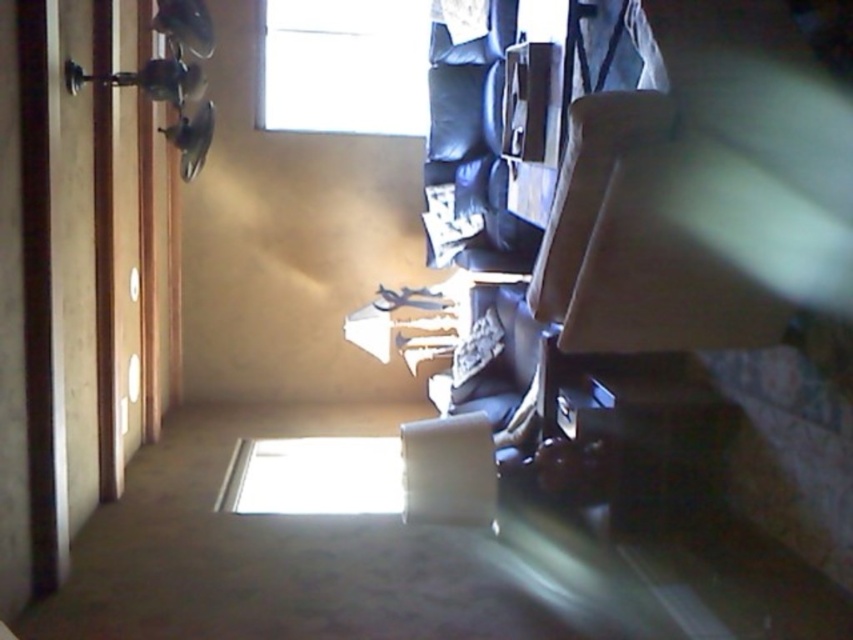
You are trying to determine which object is taller between the beige fabric armchair at center and the transparent glass window at upper center. Based on the scene description, which one is taller?

Answer: The beige fabric armchair at center is not as tall as the transparent glass window at upper center, so the transparent glass window at upper center is taller.

You are moving a large painting that is 1.2 meters wide. You want to hang it on the wall between the transparent glass window at upper center and the matte gray armchair at center. Can the painting fit horizontally between them?

The transparent glass window at upper center might be wider than the matte gray armchair at center, so the painting could potentially fit if the distance between them is sufficient. However, since the exact spacing isn not provided, it is uncertain. Consider measuring the space before hanging.

You are a delivery person standing at the entrance of the room. You need to place a package that is 6 feet long on the floor between the beige fabric armchair at center and the transparent glass window at upper center. Is there enough space for the package?

The beige fabric armchair at center is 6.19 feet from the transparent glass window at upper center. Since the package is 6 feet long, there is enough space to place it between them as the distance is slightly longer than the package.